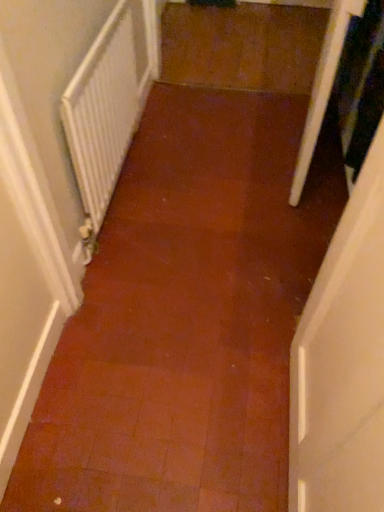
Question: In terms of width, does white textured radiator at left look wider or thinner when compared to transparent plastic screen door at right?

Choices:
 (A) thin
 (B) wide

Answer: (A)

Question: Is white textured radiator at left inside or outside of transparent plastic screen door at right?

Choices:
 (A) inside
 (B) outside

Answer: (B)

Question: From a real-world perspective, relative to transparent plastic screen door at right, is white textured radiator at left vertically above or below?

Choices:
 (A) below
 (B) above

Answer: (A)

Question: From a real-world perspective, relative to white textured radiator at left, is transparent plastic screen door at right vertically above or below?

Choices:
 (A) above
 (B) below

Answer: (A)

Question: Considering the positions of transparent plastic screen door at right and white textured radiator at left in the image, is transparent plastic screen door at right bigger or smaller than white textured radiator at left?

Choices:
 (A) big
 (B) small

Answer: (A)

Question: In the image, is transparent plastic screen door at right on the left side or the right side of white textured radiator at left?

Choices:
 (A) left
 (B) right

Answer: (B)

Question: Choose the correct answer: Is transparent plastic screen door at right inside white textured radiator at left or outside it?

Choices:
 (A) inside
 (B) outside

Answer: (B)